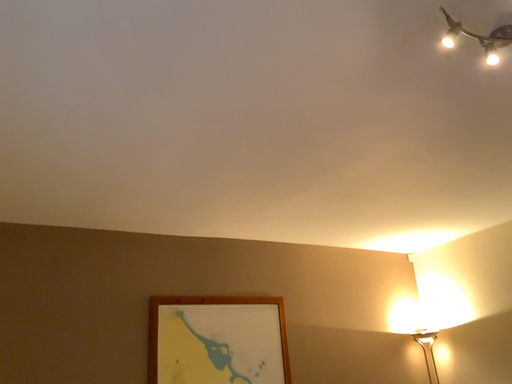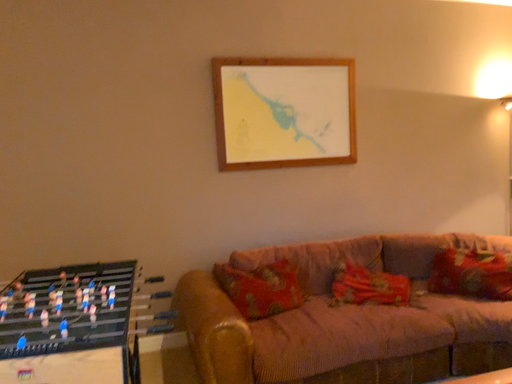
Question: Which way did the camera rotate in the video?

Choices:
 (A) rotated right
 (B) rotated left

Answer: (B)